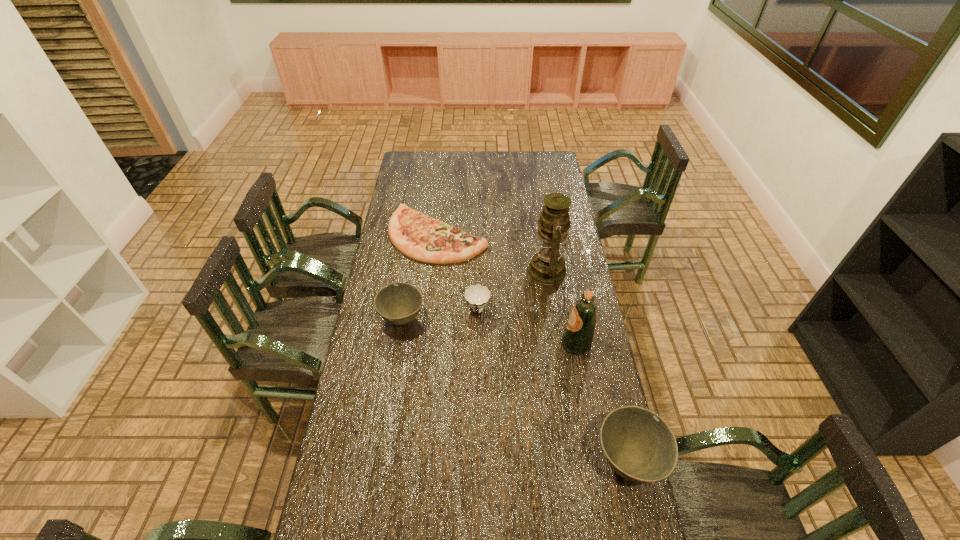
What are the coordinates of `object that ranks as the second closest to the tallest object` in the screenshot? It's located at (477, 296).

You are a GUI agent. You are given a task and a screenshot of the screen. Output one action in this format:
    pyautogui.click(x=<x>, y=<y>)
    Task: Click on the vacant space that satisfies the following two spatial constraints: 1. on the front side of the tallest object; 2. on the right side of the fourth shortest object
    
    Given the screenshot: What is the action you would take?
    pyautogui.click(x=578, y=461)

You are a GUI agent. You are given a task and a screenshot of the screen. Output one action in this format:
    pyautogui.click(x=<x>, y=<y>)
    Task: Click on the vacant region that satisfies the following two spatial constraints: 1. on the front side of the oil lamp; 2. on the left side of the nearer bowl
    This screenshot has width=960, height=540.
    Given the screenshot: What is the action you would take?
    pyautogui.click(x=578, y=461)

I want to click on vacant space that satisfies the following two spatial constraints: 1. on the front-facing side of the nearest object; 2. on the right side of the olive oil, so point(598,461).

Find the location of a particular element. vacant area that satisfies the following two spatial constraints: 1. on the front-facing side of the olive oil; 2. on the right side of the nearer bowl is located at coordinates (598, 461).

Locate an element on the screen. The width and height of the screenshot is (960, 540). free point that satisfies the following two spatial constraints: 1. on the front side of the farther bowl; 2. on the left side of the right bowl is located at coordinates (380, 461).